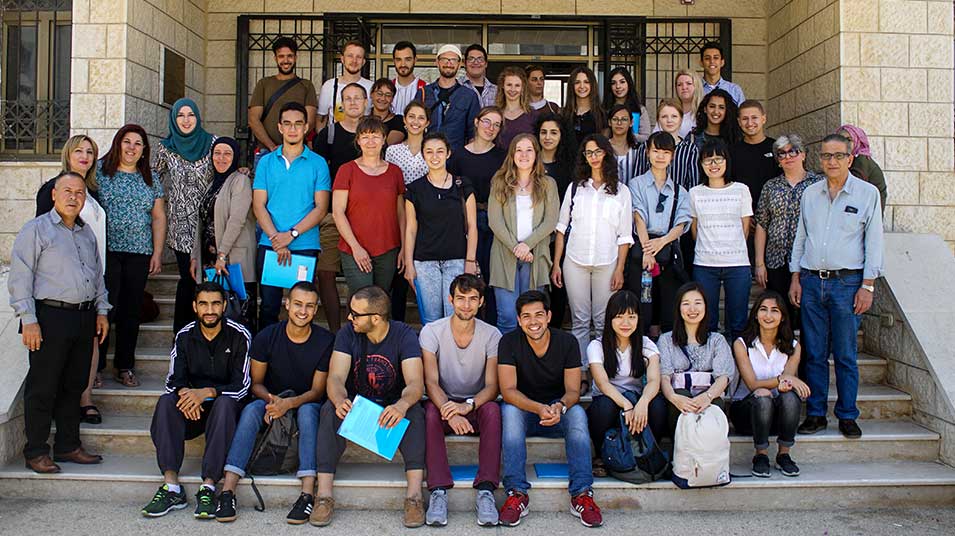
Identify the location of stair steps in photo. The width and height of the screenshot is (955, 536). (131, 466), (130, 427), (155, 382), (155, 346), (162, 320), (164, 290), (164, 265).